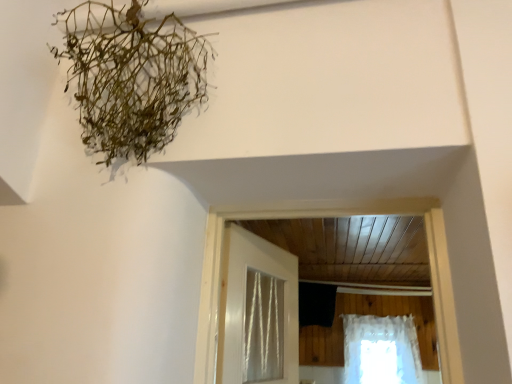
Question: Does green fibrous plant at upper left have a lesser width compared to white lace curtain at lower right?

Choices:
 (A) no
 (B) yes

Answer: (A)

Question: Are green fibrous plant at upper left and white lace curtain at lower right far apart?

Choices:
 (A) yes
 (B) no

Answer: (A)

Question: Can you confirm if green fibrous plant at upper left is smaller than white lace curtain at lower right?

Choices:
 (A) yes
 (B) no

Answer: (B)

Question: From a real-world perspective, is green fibrous plant at upper left located higher than white lace curtain at lower right?

Choices:
 (A) yes
 (B) no

Answer: (A)

Question: Does green fibrous plant at upper left come in front of white lace curtain at lower right?

Choices:
 (A) yes
 (B) no

Answer: (A)

Question: In terms of size, does white lace curtain at lower right appear bigger or smaller than green fibrous plant at upper left?

Choices:
 (A) big
 (B) small

Answer: (B)

Question: Is white lace curtain at lower right taller or shorter than green fibrous plant at upper left?

Choices:
 (A) short
 (B) tall

Answer: (A)

Question: Considering their positions, is white lace curtain at lower right located in front of or behind green fibrous plant at upper left?

Choices:
 (A) behind
 (B) front

Answer: (A)

Question: In the image, is white lace curtain at lower right on the left side or the right side of green fibrous plant at upper left?

Choices:
 (A) right
 (B) left

Answer: (A)

Question: In terms of width, does green fibrous plant at upper left look wider or thinner when compared to white glossy door at center?

Choices:
 (A) thin
 (B) wide

Answer: (B)

Question: From the image's perspective, relative to white glossy door at center, is green fibrous plant at upper left above or below?

Choices:
 (A) below
 (B) above

Answer: (B)

Question: From a real-world perspective, is green fibrous plant at upper left above or below white glossy door at center?

Choices:
 (A) below
 (B) above

Answer: (B)

Question: Is point (124, 89) closer or farther from the camera than point (282, 309)?

Choices:
 (A) closer
 (B) farther

Answer: (A)

Question: Based on their positions, is white glossy door at center located to the left or right of green fibrous plant at upper left?

Choices:
 (A) left
 (B) right

Answer: (B)

Question: Is white glossy door at center inside the boundaries of green fibrous plant at upper left, or outside?

Choices:
 (A) outside
 (B) inside

Answer: (A)